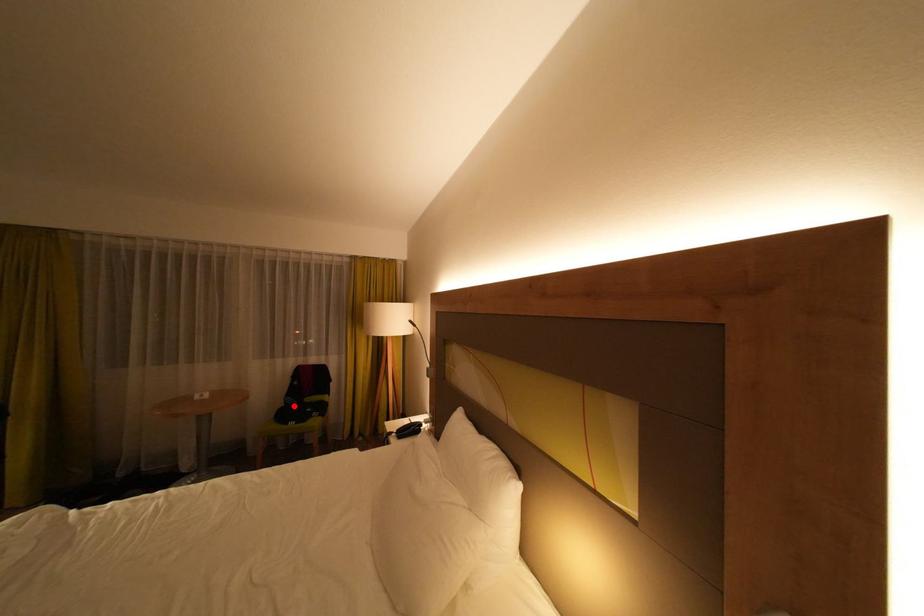
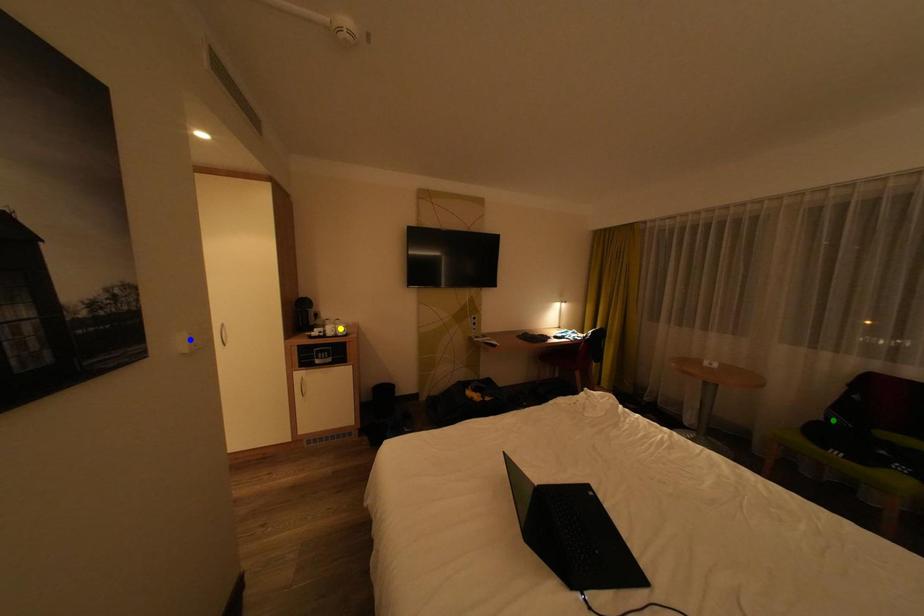
Question: I am providing you with two images of the same scene from different viewpoints. A red point is marked on the first image. You are given multiple points on the second image. Can you choose the point in image 2 that corresponds to the point in image 1?

Choices:
 (A) blue point
 (B) yellow point
 (C) green point

Answer: (C)